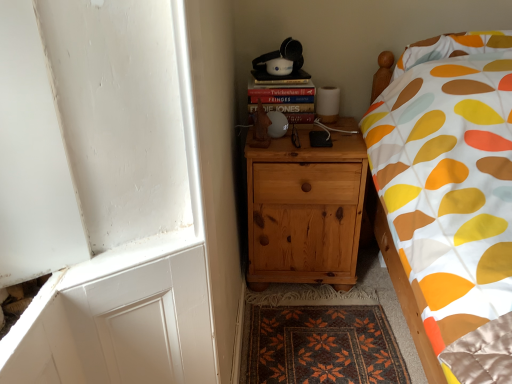
Question: Is hardcover book at upper right completely or partially outside of natural wood nightstand at center?

Choices:
 (A) no
 (B) yes

Answer: (B)

Question: From a real-world perspective, does hardcover book at upper right sit lower than natural wood nightstand at center?

Choices:
 (A) no
 (B) yes

Answer: (A)

Question: Does hardcover book at upper right contain natural wood nightstand at center?

Choices:
 (A) yes
 (B) no

Answer: (B)

Question: Is hardcover book at upper right far away from natural wood nightstand at center?

Choices:
 (A) yes
 (B) no

Answer: (B)

Question: Does hardcover book at upper right have a lesser height compared to natural wood nightstand at center?

Choices:
 (A) yes
 (B) no

Answer: (A)

Question: Is hardcover book at upper right oriented away from natural wood nightstand at center?

Choices:
 (A) no
 (B) yes

Answer: (A)

Question: Does natural wood nightstand at center have a lesser width compared to hardcover book at upper right?

Choices:
 (A) yes
 (B) no

Answer: (B)

Question: From the image's perspective, is natural wood nightstand at center beneath hardcover book at upper right?

Choices:
 (A) no
 (B) yes

Answer: (B)

Question: Considering the relative sizes of natural wood nightstand at center and hardcover book at upper right in the image provided, is natural wood nightstand at center bigger than hardcover book at upper right?

Choices:
 (A) no
 (B) yes

Answer: (B)

Question: Is hardcover book at upper right at the back of natural wood nightstand at center?

Choices:
 (A) no
 (B) yes

Answer: (A)

Question: Is natural wood nightstand at center directly adjacent to hardcover book at upper right?

Choices:
 (A) no
 (B) yes

Answer: (A)

Question: Can you confirm if natural wood nightstand at center is shorter than hardcover book at upper right?

Choices:
 (A) yes
 (B) no

Answer: (B)

Question: From a real-world perspective, is dark brown woven mat at lower center physically below hardcover book at upper right?

Choices:
 (A) yes
 (B) no

Answer: (A)